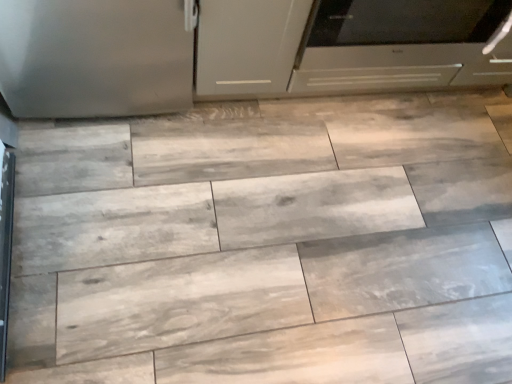
Question: Considering the relative sizes of satin silver oven at center and matte white cabinet at center in the image provided, is satin silver oven at center shorter than matte white cabinet at center?

Choices:
 (A) yes
 (B) no

Answer: (B)

Question: Is the position of satin silver oven at center less distant than that of matte white cabinet at center?

Choices:
 (A) no
 (B) yes

Answer: (A)

Question: Is satin silver oven at center behind matte white cabinet at center?

Choices:
 (A) yes
 (B) no

Answer: (A)

Question: Could you tell me if satin silver oven at center is turned towards matte white cabinet at center?

Choices:
 (A) no
 (B) yes

Answer: (A)

Question: Is satin silver oven at center far from matte white cabinet at center?

Choices:
 (A) yes
 (B) no

Answer: (B)

Question: From the image's perspective, does satin silver oven at center appear higher than matte white cabinet at center?

Choices:
 (A) no
 (B) yes

Answer: (B)

Question: Is matte white cabinet at center looking in the opposite direction of satin silver oven at center?

Choices:
 (A) yes
 (B) no

Answer: (B)

Question: From the image's perspective, is matte white cabinet at center located beneath satin silver oven at center?

Choices:
 (A) no
 (B) yes

Answer: (B)

Question: From a real-world perspective, is matte white cabinet at center under satin silver oven at center?

Choices:
 (A) no
 (B) yes

Answer: (B)

Question: From the image's perspective, does matte white cabinet at center appear higher than satin silver oven at center?

Choices:
 (A) yes
 (B) no

Answer: (B)

Question: Is satin silver oven at center located within matte white cabinet at center?

Choices:
 (A) no
 (B) yes

Answer: (A)

Question: Is the depth of matte white cabinet at center greater than that of satin silver oven at center?

Choices:
 (A) no
 (B) yes

Answer: (A)

Question: Is matte white cabinet at center bigger or smaller than satin silver oven at center?

Choices:
 (A) big
 (B) small

Answer: (B)